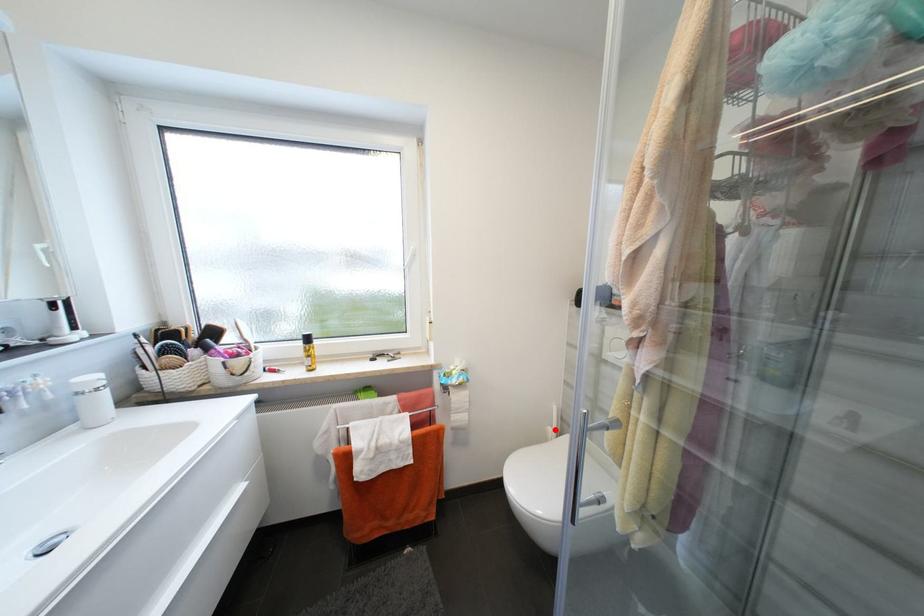
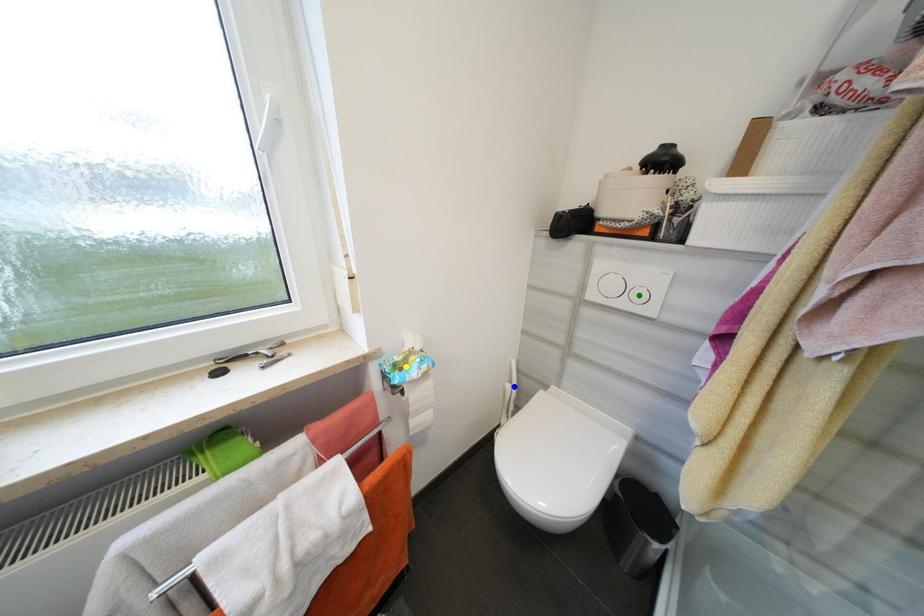
Question: I am providing you with two images of the same scene from different viewpoints. A red point is marked on the first image. You are given multiple points on the second image. Which point in image 2 is actually the same real-world point as the red point in image 1?

Choices:
 (A) yellow point
 (B) blue point
 (C) green point

Answer: (B)